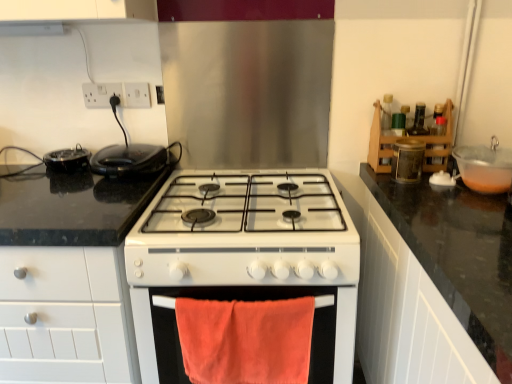
Question: Is black glossy pan at left, which ranks as the 1th kitchen appliance in left-to-right order, positioned with its back to white glossy gas stove at center?

Choices:
 (A) yes
 (B) no

Answer: (B)

Question: Does black glossy pan at left, arranged as the 2th kitchen appliance when viewed from the right, have a lesser height compared to white glossy gas stove at center?

Choices:
 (A) yes
 (B) no

Answer: (A)

Question: Can you confirm if black glossy pan at left, which ranks as the 1th kitchen appliance in left-to-right order, is positioned to the right of white glossy gas stove at center?

Choices:
 (A) no
 (B) yes

Answer: (A)

Question: Can you confirm if black glossy pan at left, which ranks as the 1th kitchen appliance in left-to-right order, is thinner than white glossy gas stove at center?

Choices:
 (A) yes
 (B) no

Answer: (A)

Question: Can you confirm if black glossy pan at left, arranged as the 2th kitchen appliance when viewed from the right, is smaller than white glossy gas stove at center?

Choices:
 (A) yes
 (B) no

Answer: (A)

Question: Is black glossy pan at left, arranged as the 2th kitchen appliance when viewed from the right, positioned behind white glossy gas stove at center?

Choices:
 (A) yes
 (B) no

Answer: (A)

Question: Is the position of black glossy waffle maker at left, arranged as the second kitchen appliance when viewed from the left, less distant than that of black glossy pan at left, which ranks as the 1th kitchen appliance in left-to-right order?

Choices:
 (A) yes
 (B) no

Answer: (A)

Question: Is black glossy waffle maker at left, arranged as the second kitchen appliance when viewed from the left, far from black glossy pan at left, which ranks as the 1th kitchen appliance in left-to-right order?

Choices:
 (A) no
 (B) yes

Answer: (A)

Question: Can you confirm if black glossy waffle maker at left, arranged as the second kitchen appliance when viewed from the left, is wider than black glossy pan at left, which ranks as the 1th kitchen appliance in left-to-right order?

Choices:
 (A) no
 (B) yes

Answer: (B)

Question: Is black glossy waffle maker at left, which is the 1th kitchen appliance in right-to-left order, looking in the opposite direction of black glossy pan at left, which ranks as the 1th kitchen appliance in left-to-right order?

Choices:
 (A) no
 (B) yes

Answer: (A)

Question: Considering the relative sizes of black glossy waffle maker at left, arranged as the second kitchen appliance when viewed from the left, and black glossy pan at left, arranged as the 2th kitchen appliance when viewed from the right, in the image provided, is black glossy waffle maker at left, arranged as the second kitchen appliance when viewed from the left, smaller than black glossy pan at left, arranged as the 2th kitchen appliance when viewed from the right,?

Choices:
 (A) yes
 (B) no

Answer: (B)

Question: Is black glossy waffle maker at left, which is the 1th kitchen appliance in right-to-left order, at the right side of black glossy pan at left, which ranks as the 1th kitchen appliance in left-to-right order?

Choices:
 (A) no
 (B) yes

Answer: (B)

Question: Is transparent plastic bowl at right to the left of white glossy gas stove at center from the viewer's perspective?

Choices:
 (A) yes
 (B) no

Answer: (B)